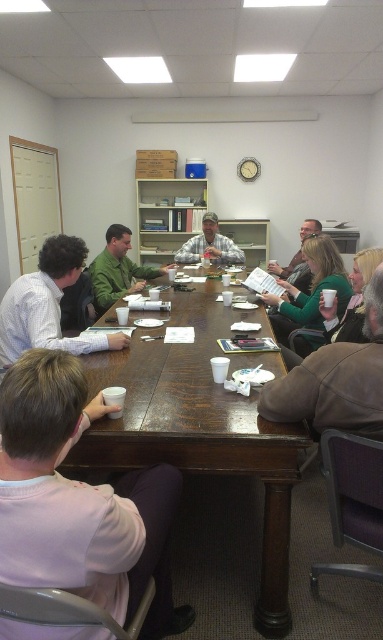
You are standing at point A which is at coordinate point A at (307, 221) and want to walk to point B at coordinate point B at (234, 243). Which direction should you move in to reach point B from point A?

To move from point A at (307, 221) to point B at (234, 243), you should move downward and to the right since point B is behind point A.

You are a photographer standing at the entrance of the meeting room. You need to capture a photo that includes both the brown leather jacket at lower right and the green matte shirt at center. Based on their positions, which object should be placed on the right side of the other in the final photo?

The brown leather jacket at lower right is positioned on the right side of green matte shirt at center, so in the photo, the brown leather jacket at lower right should be on the right side of the green matte shirt at center.